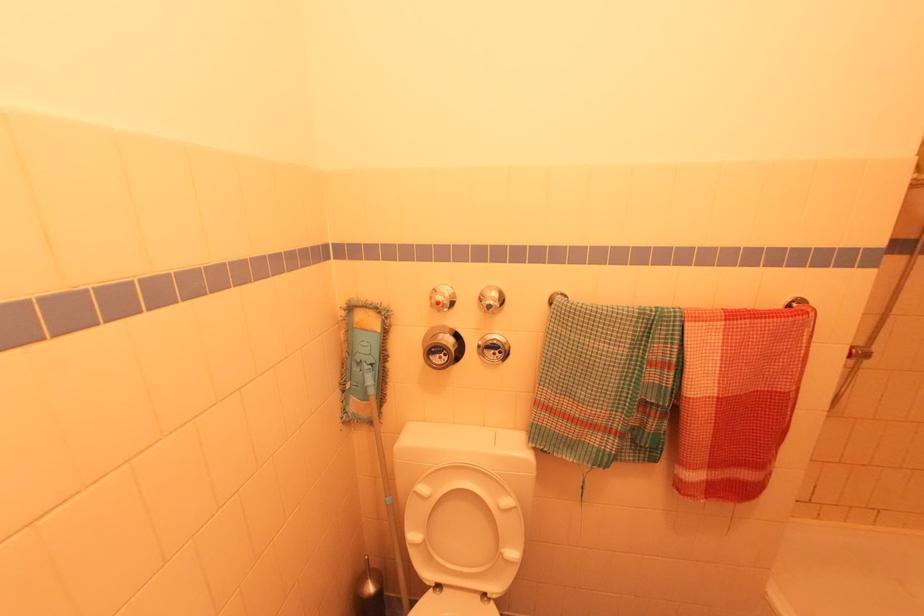
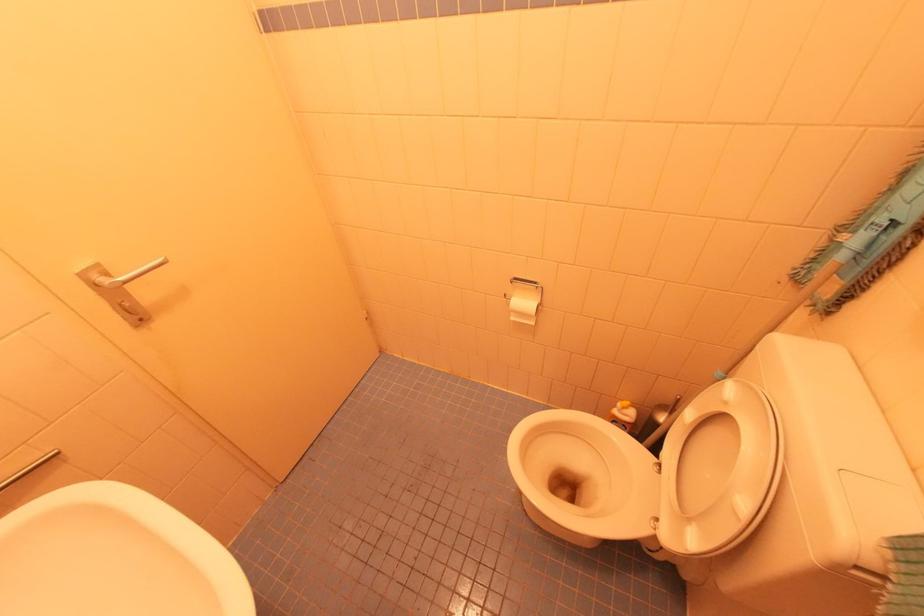
Based on the continuous images, in which direction is the camera rotating?

The camera's rotation is toward left-down.